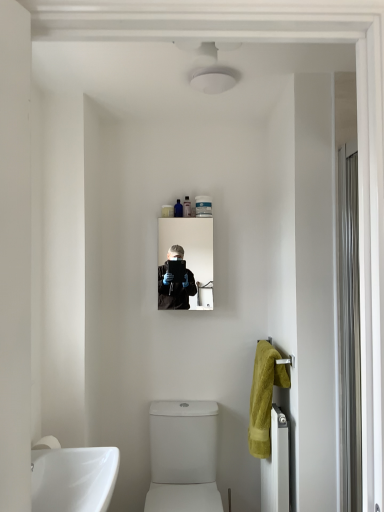
Question: Based on their sizes in the image, would you say translucent plastic tube at upper center, the second toiletry viewed from the left, is bigger or smaller than clear glass screen door at right?

Choices:
 (A) small
 (B) big

Answer: (A)

Question: Does point (183, 204) appear closer or farther from the camera than point (352, 480)?

Choices:
 (A) farther
 (B) closer

Answer: (A)

Question: Estimate the real-world distances between objects in this image. Which object is farther from the white glossy toilet at lower center?

Choices:
 (A) clear glass screen door at right
 (B) translucent plastic tube at upper center, the second toiletry viewed from the left
 (C) white metallic radiator at lower right
 (D) white matte tube at upper center, arranged as the 1th toiletry when viewed from the right
 (E) soft yellow towel at right

Answer: (B)

Question: Which object is positioned closest to the soft yellow towel at right?

Choices:
 (A) white glossy toilet at lower center
 (B) clear glass mirror at center
 (C) white metallic radiator at lower right
 (D) white matte tube at upper center, arranged as the 1th toiletry when viewed from the right
 (E) translucent plastic tube at upper center, which is counted as the second toiletry, starting from the right

Answer: (C)